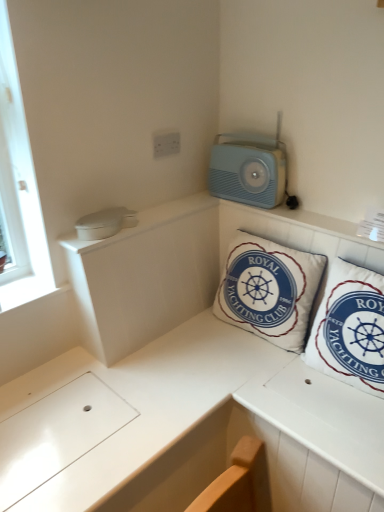
Question: Does light blue plastic radio at upper right have a lesser width compared to white cotton cushion at center, which is the 2th pillow from right to left?

Choices:
 (A) no
 (B) yes

Answer: (B)

Question: Does light blue plastic radio at upper right appear on the left side of white cotton cushion at center, which is the 2th pillow from right to left?

Choices:
 (A) no
 (B) yes

Answer: (B)

Question: From the image's perspective, is light blue plastic radio at upper right under white cotton cushion at center, which is the 2th pillow from right to left?

Choices:
 (A) no
 (B) yes

Answer: (A)

Question: Considering the relative positions of light blue plastic radio at upper right and white cotton cushion at center, which is the 2th pillow from right to left, in the image provided, is light blue plastic radio at upper right in front of white cotton cushion at center, which is the 2th pillow from right to left,?

Choices:
 (A) no
 (B) yes

Answer: (A)

Question: From a real-world perspective, is light blue plastic radio at upper right on top of white cotton cushion at center, the first pillow from the left?

Choices:
 (A) no
 (B) yes

Answer: (B)

Question: Does light blue plastic radio at upper right have a greater height compared to white cotton cushion at center, which is the 2th pillow from right to left?

Choices:
 (A) yes
 (B) no

Answer: (B)

Question: Can you confirm if white fabric pillow at upper right, positioned as the second pillow in left-to-right order, is thinner than white plastic electric outlet at upper center?

Choices:
 (A) no
 (B) yes

Answer: (A)

Question: Does white fabric pillow at upper right, positioned as the second pillow in left-to-right order, come behind white plastic electric outlet at upper center?

Choices:
 (A) no
 (B) yes

Answer: (A)

Question: From a real-world perspective, is white fabric pillow at upper right, positioned as the second pillow in left-to-right order, below white plastic electric outlet at upper center?

Choices:
 (A) no
 (B) yes

Answer: (B)

Question: Is white fabric pillow at upper right, positioned as the second pillow in left-to-right order, completely or partially outside of white plastic electric outlet at upper center?

Choices:
 (A) no
 (B) yes

Answer: (B)

Question: From the image's perspective, does white fabric pillow at upper right, which is the first pillow from right to left, appear higher than white plastic electric outlet at upper center?

Choices:
 (A) no
 (B) yes

Answer: (A)

Question: Does white fabric pillow at upper right, positioned as the second pillow in left-to-right order, come in front of white plastic electric outlet at upper center?

Choices:
 (A) no
 (B) yes

Answer: (B)

Question: Can you confirm if white fabric pillow at upper right, which is the first pillow from right to left, is thinner than light blue plastic radio at upper right?

Choices:
 (A) no
 (B) yes

Answer: (A)